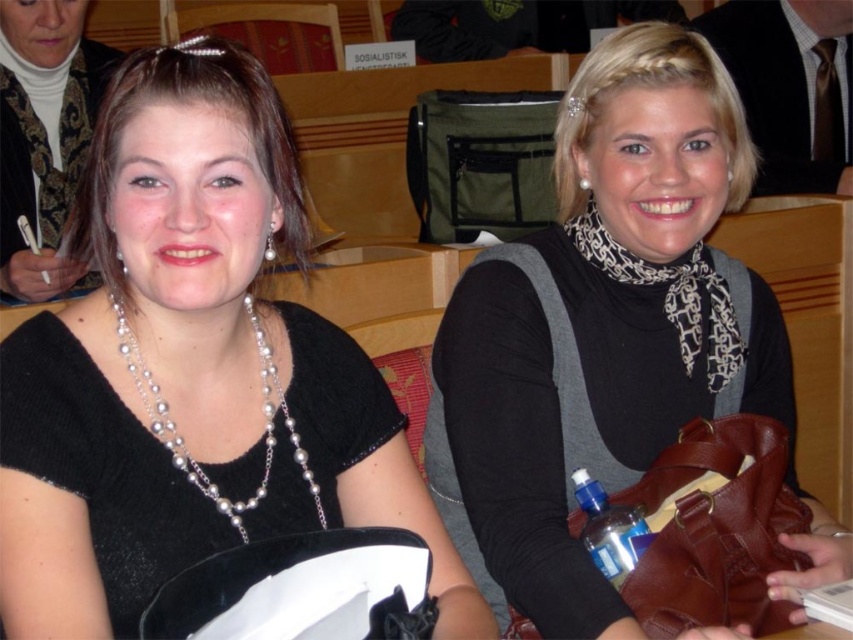
Does black velvet hat at left have a lesser height compared to pearl necklace at center?

Yes, black velvet hat at left is shorter than pearl necklace at center.

Does black velvet hat at left come behind pearl necklace at center?

That is False.

Is point (317, 444) more distant than point (13, 24)?

No, (317, 444) is in front of (13, 24).

At what (x,y) coordinates should I click in order to perform the action: click on black velvet hat at left. Please return your answer as a coordinate pair (x, y). Looking at the image, I should click on (190, 371).

Is black velvet hat at left behind black matte scarf at upper right?

No, black velvet hat at left is in front of black matte scarf at upper right.

Who is more distant from viewer, (318, 524) or (772, 579)?

The point (772, 579) is more distant.

Image resolution: width=853 pixels, height=640 pixels. What are the coordinates of `black velvet hat at left` in the screenshot? It's located at (190, 371).

Is point (126, 259) positioned behind point (263, 336)?

No, (126, 259) is closer to viewer.

Between point (41, 506) and point (273, 436), which one is positioned behind?

Positioned behind is point (273, 436).

Identify the location of black velvet hat at left. coord(190,371).